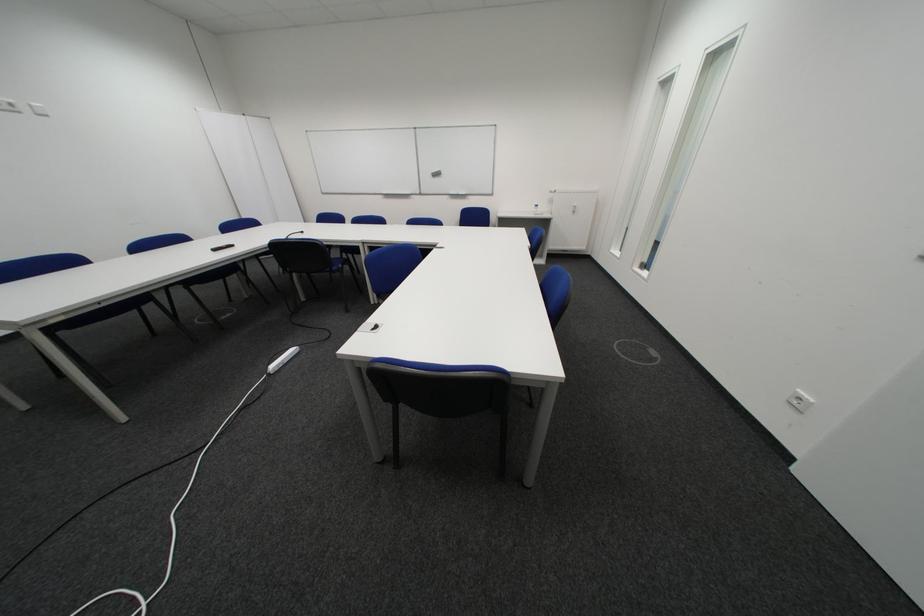
Image resolution: width=924 pixels, height=616 pixels. Find the location of `white wall outlet`. white wall outlet is located at coordinates (799, 400).